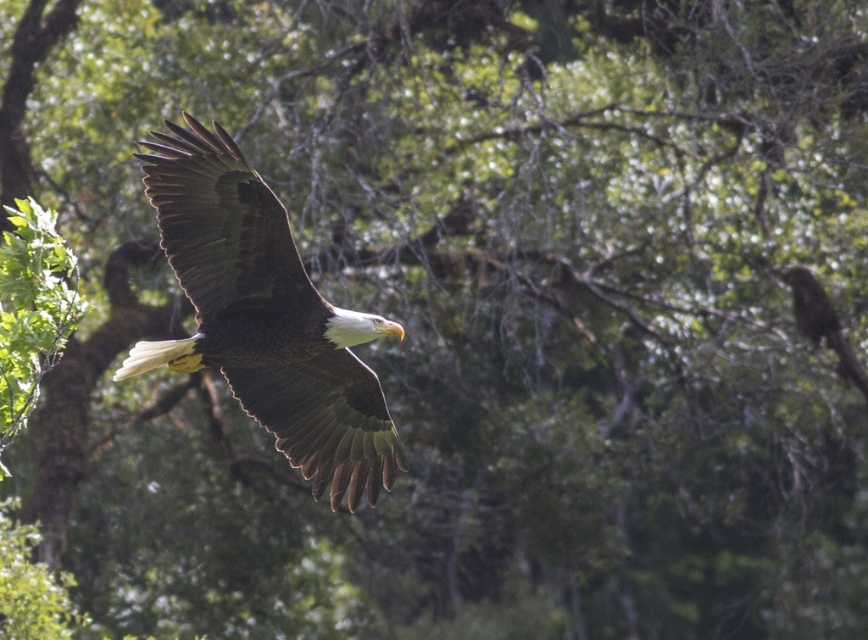
Does point (135, 371) come farther from viewer compared to point (863, 378)?

No, (135, 371) is closer to viewer.

Is dark brown feathers at center thinner than brown textured bird at right?

Incorrect, dark brown feathers at center's width is not less than brown textured bird at right's.

The image size is (868, 640). What do you see at coordinates (265, 317) in the screenshot? I see `dark brown feathers at center` at bounding box center [265, 317].

Locate an element on the screen. The image size is (868, 640). dark brown feathers at center is located at coordinates (265, 317).